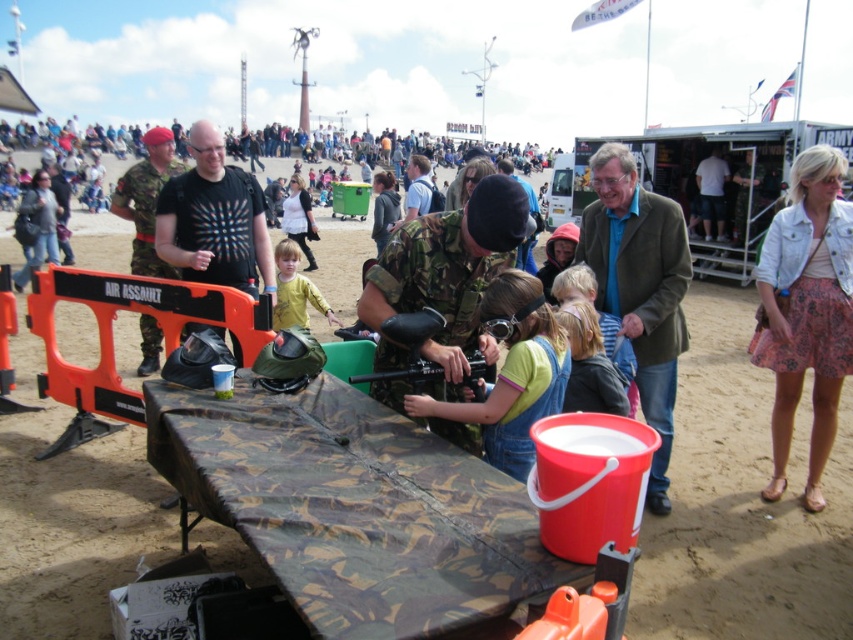
Does camo fabric uniform at center have a lesser width compared to camouflage uniform at center?

Indeed, camo fabric uniform at center has a lesser width compared to camouflage uniform at center.

Locate an element on the screen. camo fabric uniform at center is located at coordinates (445, 282).

Who is more forward, (618, 284) or (144, 209)?

Point (618, 284) is in front.

In the scene shown: Who is higher up, matte brown jacket at center or camouflage uniform at center?

camouflage uniform at center is above.

Where is `matte brown jacket at center`? This screenshot has height=640, width=853. matte brown jacket at center is located at coordinates (640, 289).

Where is `matte brown jacket at center`? The image size is (853, 640). matte brown jacket at center is located at coordinates (640, 289).

Can you confirm if matte brown jacket at center is taller than yellow matte shirt at center?

Indeed, matte brown jacket at center has a greater height compared to yellow matte shirt at center.

Can you confirm if matte brown jacket at center is positioned below yellow matte shirt at center?

Indeed, matte brown jacket at center is positioned under yellow matte shirt at center.

Does point (627, 177) come closer to viewer compared to point (325, 301)?

Yes, it is in front of point (325, 301).

Find the location of a particular element. The width and height of the screenshot is (853, 640). matte brown jacket at center is located at coordinates (640, 289).